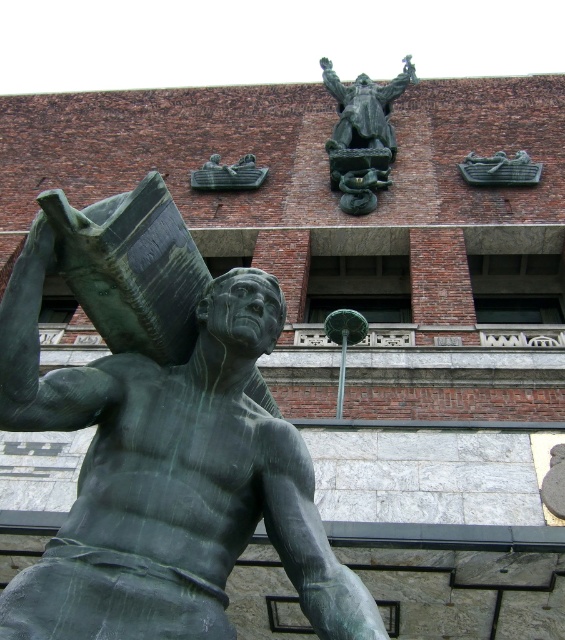
You are an art student analyzing the statue arrangement in the image. You notice the green patina bronze statue at center and the bronze statue at upper center. Which of these two statues is shorter in height?

The green patina bronze statue at center is shorter in height compared to the bronze statue at upper center.